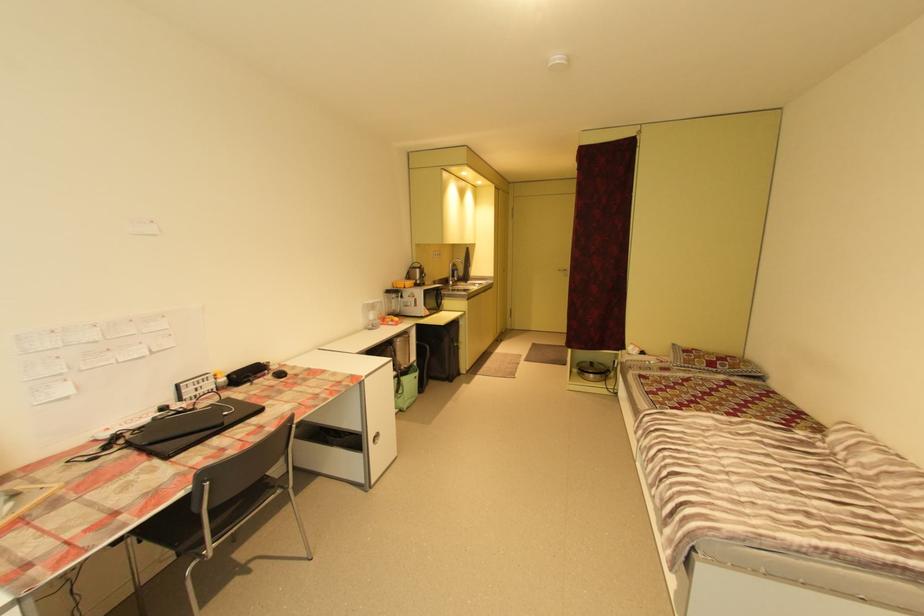
Where would you open the black laptop? Please return your answer as a coordinate pair (x, y).

(190, 427)